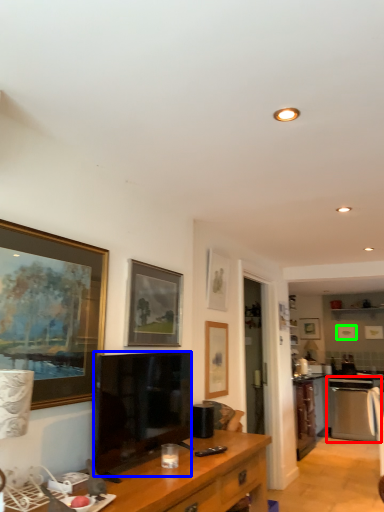
Question: Considering the real-world distances, which object is farthest from oven (highlighted by a red box)? television (highlighted by a blue box) or picture frame (highlighted by a green box)?

Choices:
 (A) television
 (B) picture frame

Answer: (A)